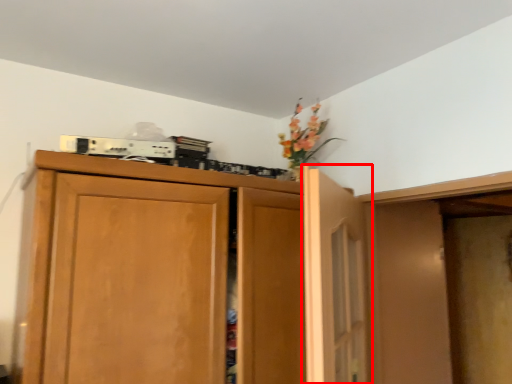
Question: From the image's perspective, what is the correct spatial relationship of door (annotated by the red box) in relation to cupboard?

Choices:
 (A) below
 (B) above

Answer: (B)